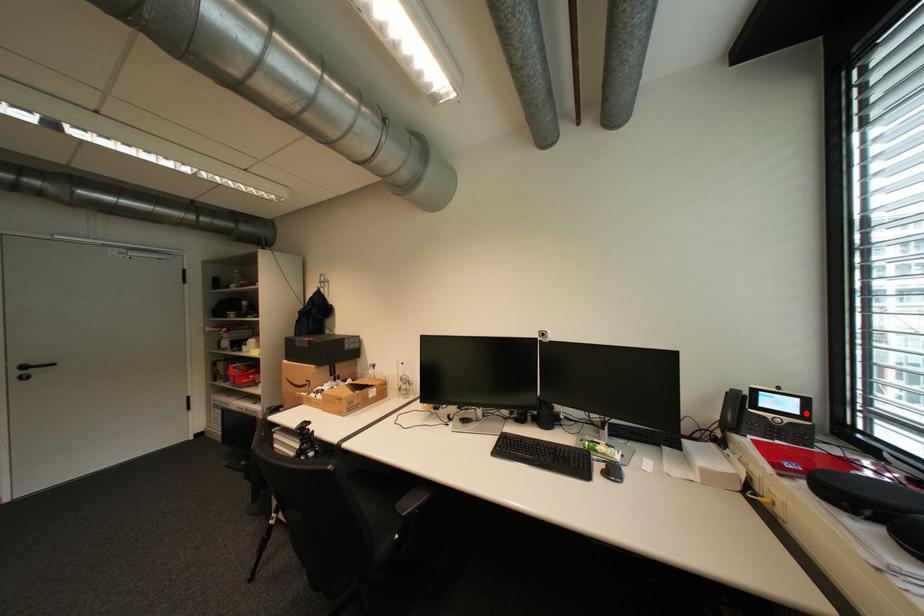
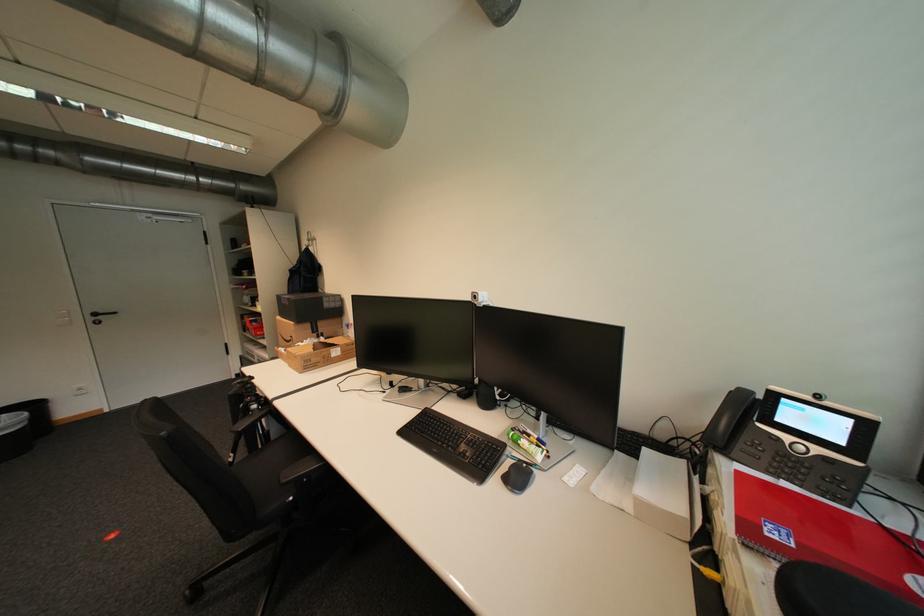
In the second image, find the point that corresponds to the highlighted location in the first image.

(850, 443)